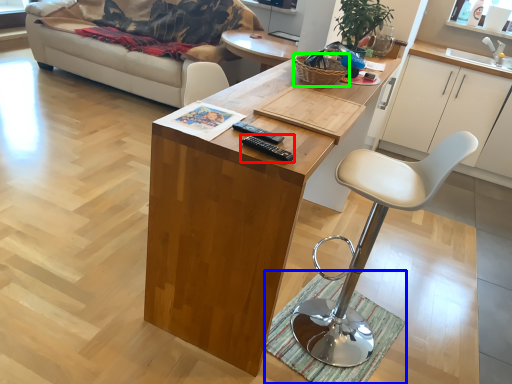
Question: Estimate the real-world distances between objects in this image. Which object is farther from remote (highlighted by a red box), mat (highlighted by a blue box) or basket (highlighted by a green box)?

Choices:
 (A) mat
 (B) basket

Answer: (A)